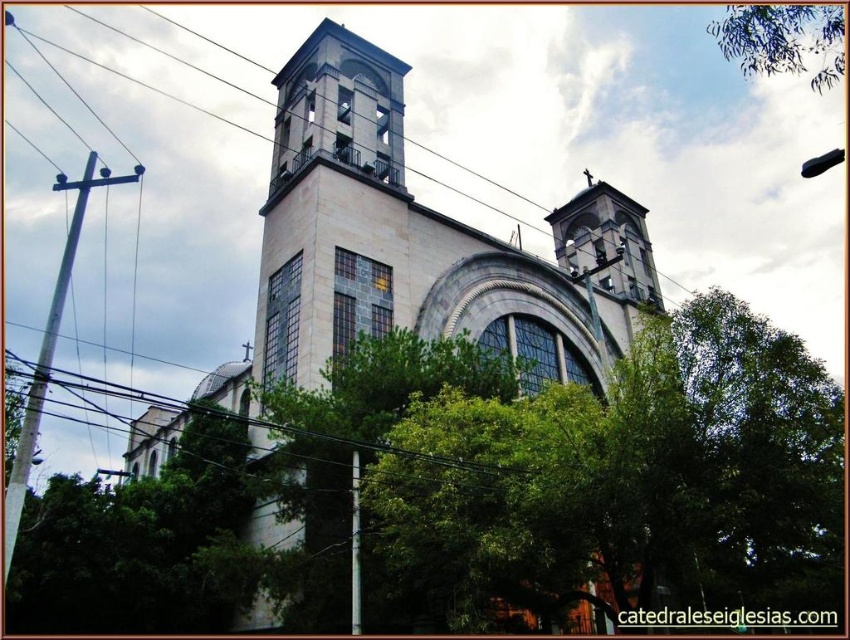
Which of these two, white stone church at center or green leafy tree at upper center, stands taller?

Standing taller between the two is white stone church at center.

Between white stone church at center and green leafy tree at upper center, which one appears on the left side from the viewer's perspective?

white stone church at center

Who is more distant from viewer, (x=303, y=378) or (x=796, y=35)?

Positioned behind is point (x=796, y=35).

I want to click on white stone church at center, so click(416, 244).